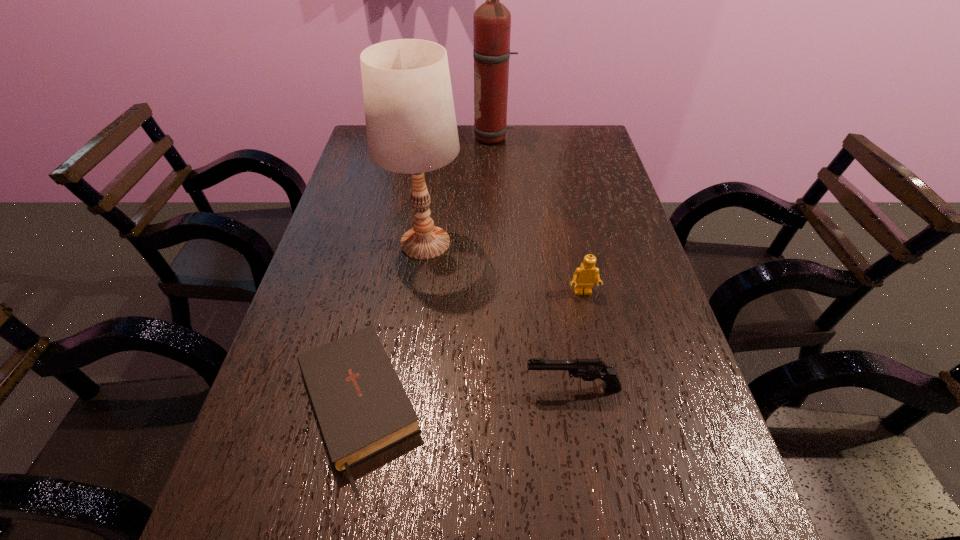
At what (x,y) coordinates should I click in order to perform the action: click on the farthest object. Please return your answer as a coordinate pair (x, y). The width and height of the screenshot is (960, 540). Looking at the image, I should click on (492, 20).

This screenshot has width=960, height=540. I want to click on lamp, so point(411,126).

The image size is (960, 540). Find the location of `the third nearest object`. the third nearest object is located at coordinates (585, 276).

Find the location of a particular element. This screenshot has width=960, height=540. gun is located at coordinates (588, 369).

Locate an element on the screen. Bible is located at coordinates (361, 407).

The image size is (960, 540). What are the coordinates of `vacant region located 0.390m on the side of the fire extinguisher with the label and nozzle` in the screenshot? It's located at (361, 138).

You are a GUI agent. You are given a task and a screenshot of the screen. Output one action in this format:
    pyautogui.click(x=<x>, y=<y>)
    Task: Click on the vacant position located on the side of the fire extinguisher with the label and nozzle
    
    Given the screenshot: What is the action you would take?
    (361, 138)

You are a GUI agent. You are given a task and a screenshot of the screen. Output one action in this format:
    pyautogui.click(x=<x>, y=<y>)
    Task: Click on the vacant space positioned 0.140m on the side of the fire extinguisher with the label and nozzle
    The height and width of the screenshot is (540, 960).
    Given the screenshot: What is the action you would take?
    pyautogui.click(x=434, y=138)

Identify the location of free point located 0.270m on the right of the lamp. (567, 242).

In order to click on vacant region located 0.300m on the face of the third farthest object in this screenshot , I will do `click(612, 423)`.